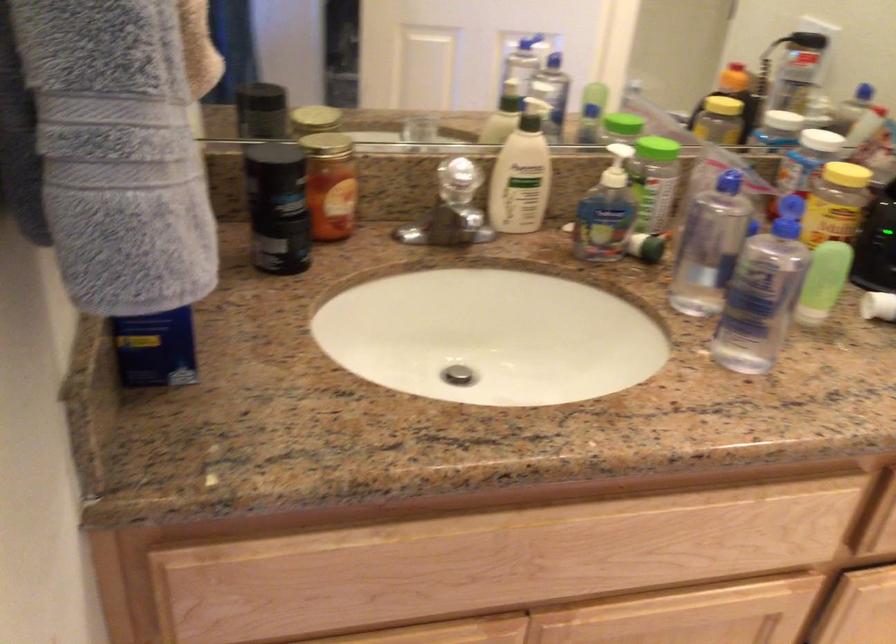
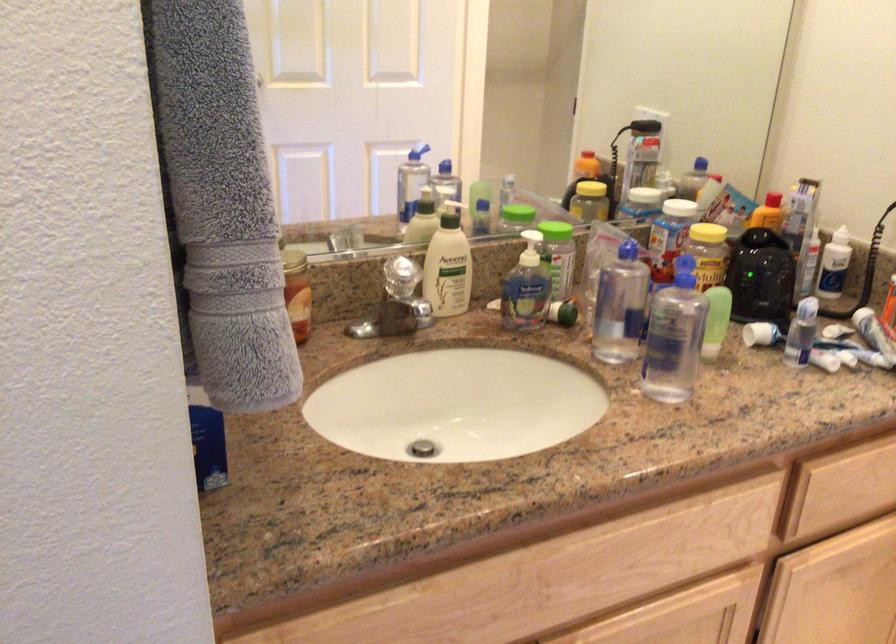
The point at [519,176] is marked in the first image. Where is the corresponding point in the second image?

(448, 265)